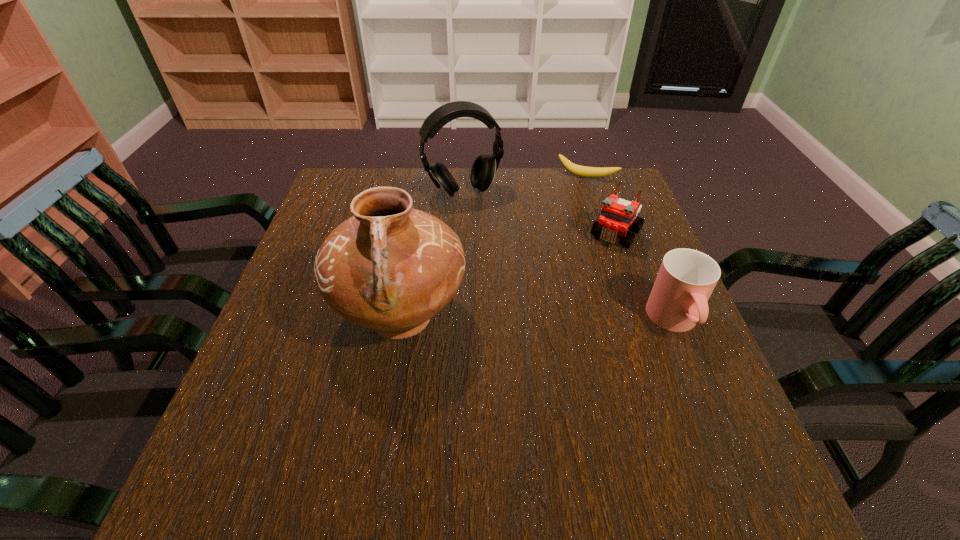
Locate an element on the screen. The width and height of the screenshot is (960, 540). free spot on the desktop that is between the pottery and the cup and is positioned on the front-facing side of the third nearest object is located at coordinates (557, 320).

Locate an element on the screen. The height and width of the screenshot is (540, 960). free space on the desktop that is between the pottery and the cup and is positioned on the upward curve of the shortest object is located at coordinates (534, 319).

The image size is (960, 540). I want to click on free space on the desktop that is between the pottery and the cup and is positioned on the ear cups of the earphone, so click(531, 319).